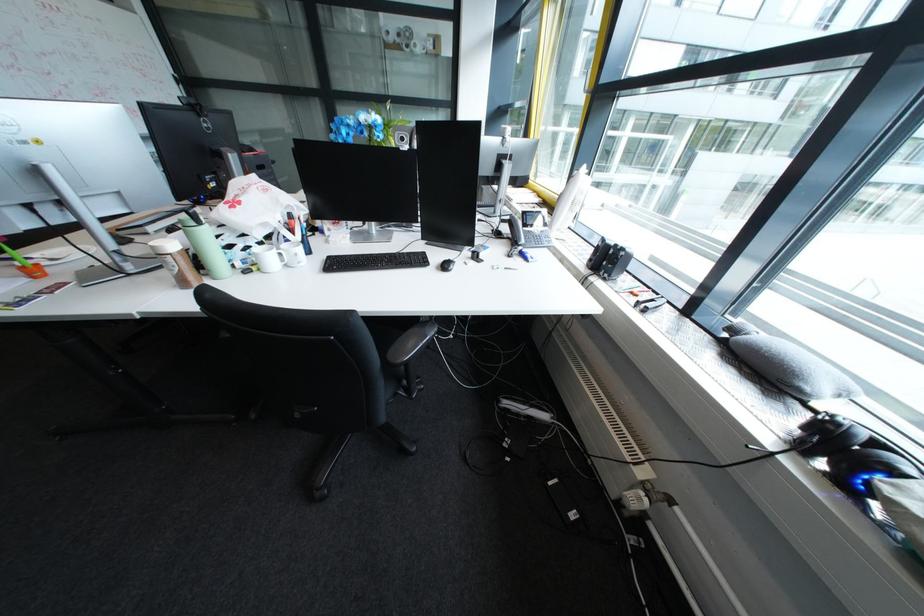
This screenshot has width=924, height=616. I want to click on telephone handset, so click(516, 231).